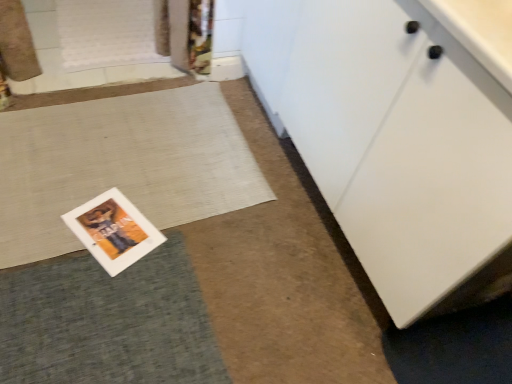
Describe the element at coordinates (113, 230) in the screenshot. I see `white paper postcard at lower left` at that location.

The height and width of the screenshot is (384, 512). I want to click on white paper postcard at lower left, so click(113, 230).

At what (x,y) coordinates should I click in order to perform the action: click on white paper postcard at lower left. Please return your answer as a coordinate pair (x, y). Looking at the image, I should click on (113, 230).